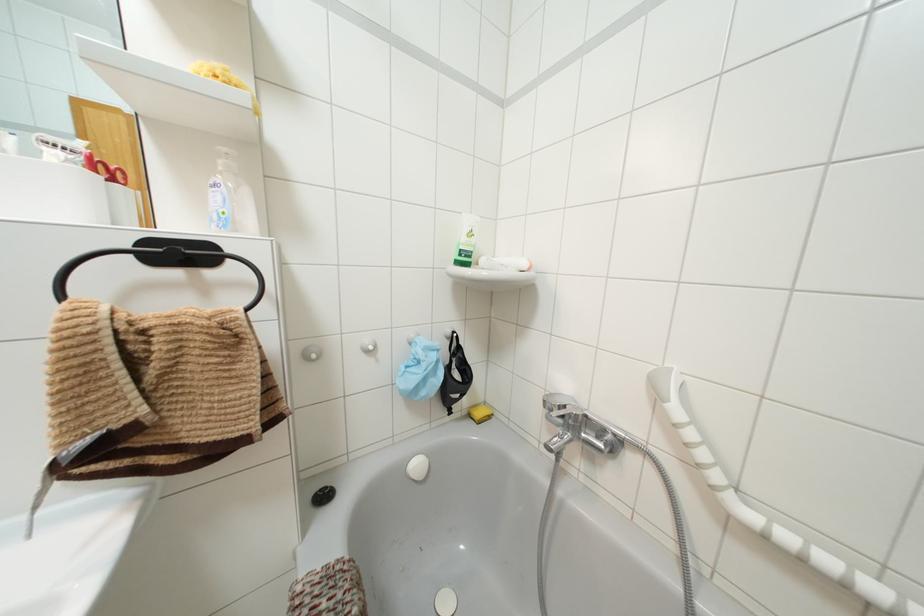
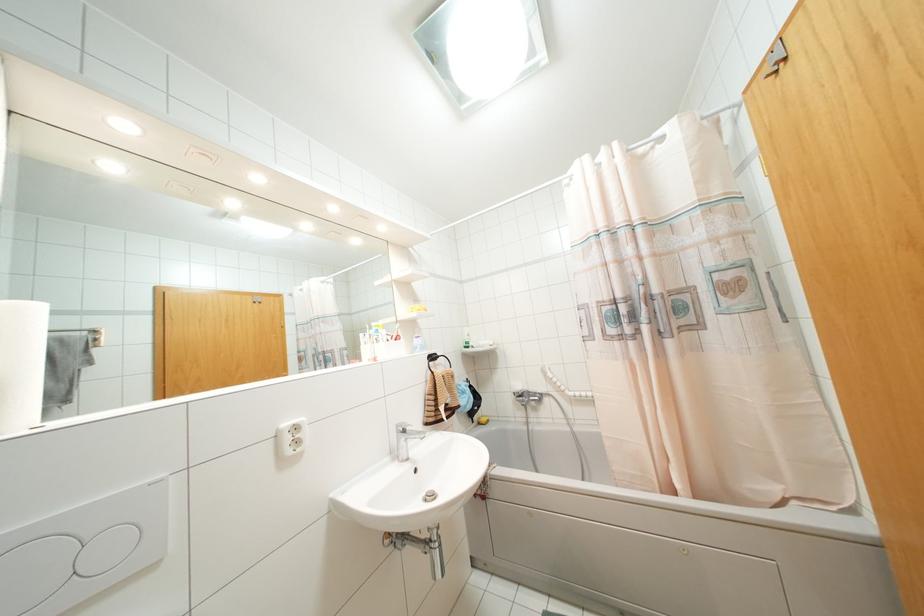
In the second image, find the point that corresponds to (x=469, y=233) in the first image.

(468, 334)